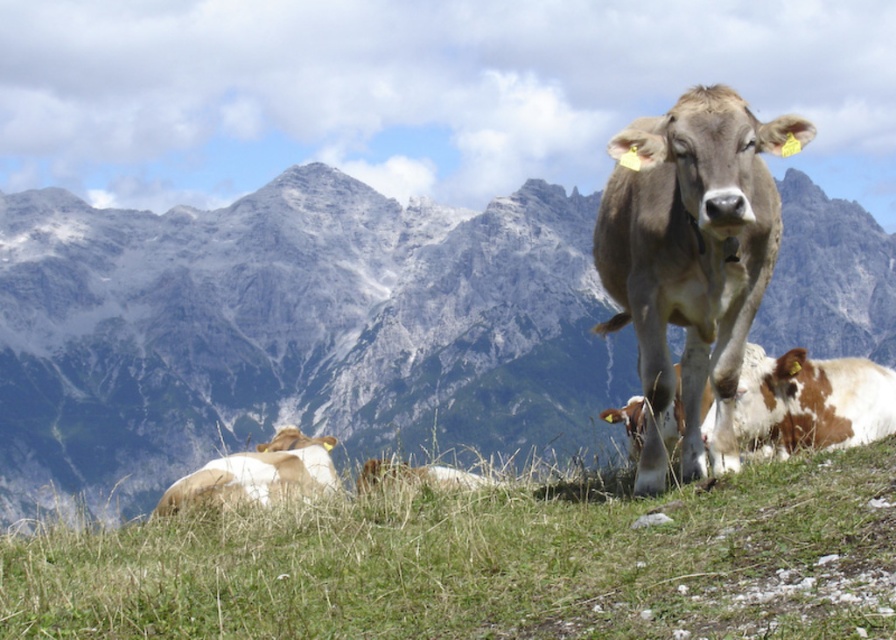
Is point (634, 243) positioned behind point (235, 467)?

No, (634, 243) is closer to viewer.

Which is in front, point (708, 305) or point (333, 444)?

Point (708, 305) is in front.

Identify the location of brown glossy cow at center. This screenshot has width=896, height=640. (691, 259).

Between gray rocky mountain range at upper center and white and brown cow at lower left, which one appears on the right side from the viewer's perspective?

From the viewer's perspective, gray rocky mountain range at upper center appears more on the right side.

Between gray rocky mountain range at upper center and white and brown cow at lower left, which one is positioned higher?

gray rocky mountain range at upper center is higher up.

Describe the element at coordinates (290, 330) in the screenshot. Image resolution: width=896 pixels, height=640 pixels. I see `gray rocky mountain range at upper center` at that location.

Identify the location of gray rocky mountain range at upper center. (290, 330).

In the scene shown: Is green grass at lower center below brown glossy cow at center?

Yes.

Locate an element on the screen. green grass at lower center is located at coordinates (487, 563).